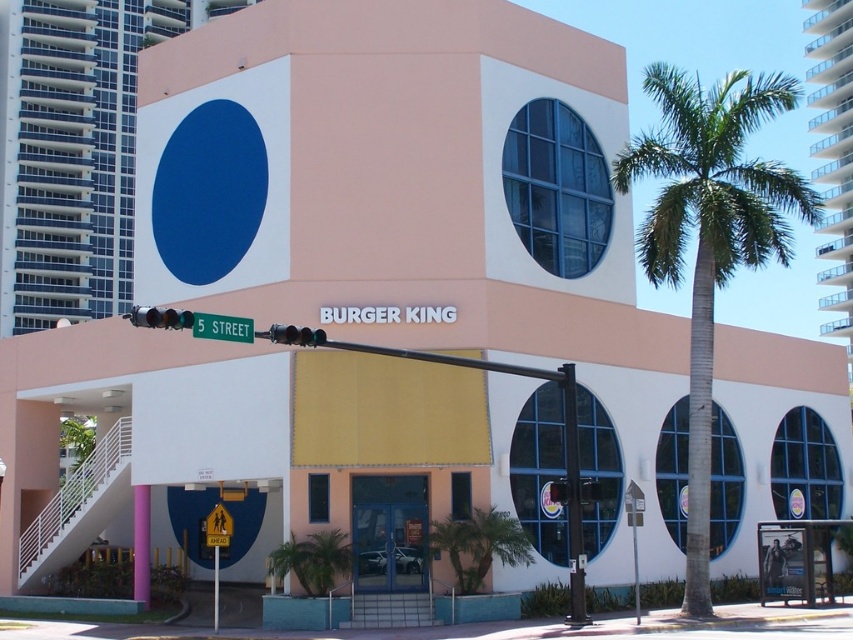
You are a delivery driver needing to park your car near the Burger King entrance. The parking spot you found is exactly halfway between the green leafy palm tree at right and the metallic traffic light at center. Is this parking spot close enough to the entrance for a quick delivery?

The distance between the green leafy palm tree at right and the metallic traffic light at center is 35.14 meters. Half of that distance is 17.57 meters, so the parking spot is approximately 17.57 meters away from the entrance. This distance may be too far for a quick delivery, depending on time constraints.

You are standing at the entrance of the Burger King restaurant and want to find the green leafy palm tree at right. According to the coordinates provided, where should you look relative to the entrance?

The green leafy palm tree at right is located at coordinates point (711, 236), which means it is positioned to the right and slightly above the entrance.

You are standing at the entrance of the Burger King restaurant. Looking towards the green leafy palm tree at right, what are the coordinates of its position relative to the entrance?

The green leafy palm tree at right is located at coordinates point (711, 236) relative to the entrance.